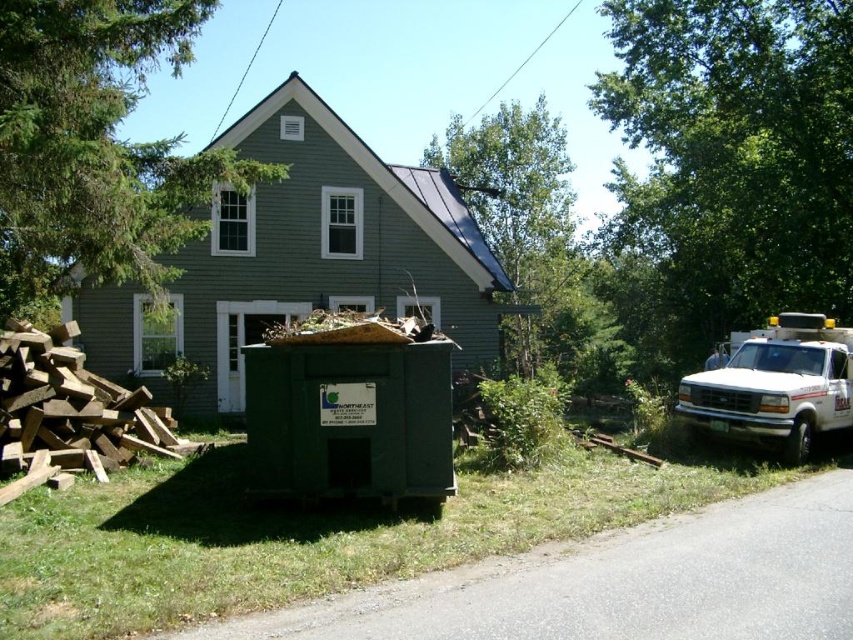
Which is behind, point (837, 28) or point (123, 8)?

The point (837, 28) is behind.

Who is taller, green leafy tree at upper right or green leafy tree at upper left?

Standing taller between the two is green leafy tree at upper right.

Describe the element at coordinates (733, 157) in the screenshot. This screenshot has width=853, height=640. I see `green leafy tree at upper right` at that location.

You are a GUI agent. You are given a task and a screenshot of the screen. Output one action in this format:
    pyautogui.click(x=<x>, y=<y>)
    Task: Click on the green leafy tree at upper right
    The image size is (853, 640).
    Given the screenshot: What is the action you would take?
    (x=733, y=157)

Between green leafy tree at upper right and green leafy tree at upper center, which one is positioned lower?

green leafy tree at upper center is below.

Which of these two, green leafy tree at upper right or green leafy tree at upper center, stands taller?

green leafy tree at upper right is taller.

This screenshot has width=853, height=640. Describe the element at coordinates (733, 157) in the screenshot. I see `green leafy tree at upper right` at that location.

The height and width of the screenshot is (640, 853). Find the location of `green leafy tree at upper right`. green leafy tree at upper right is located at coordinates (733, 157).

Is the position of green leafy tree at upper right less distant than that of brown rough wood at lower left?

That is False.

Does point (746, 51) come closer to viewer compared to point (120, 396)?

No, (746, 51) is further to viewer.

At what (x,y) coordinates should I click in order to perform the action: click on green leafy tree at upper right. Please return your answer as a coordinate pair (x, y). Looking at the image, I should click on (733, 157).